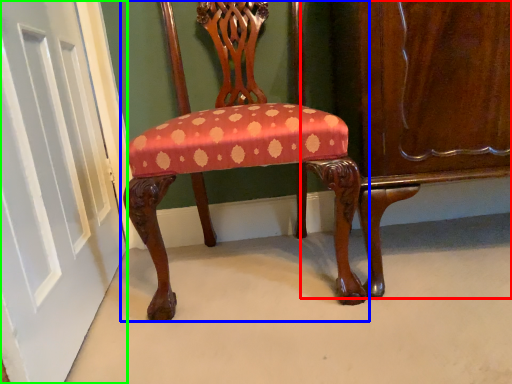
Question: Based on their relative distances, which object is farther from dresser (highlighted by a red box)? Choose from chair (highlighted by a blue box) and door (highlighted by a green box).

Choices:
 (A) chair
 (B) door

Answer: (B)